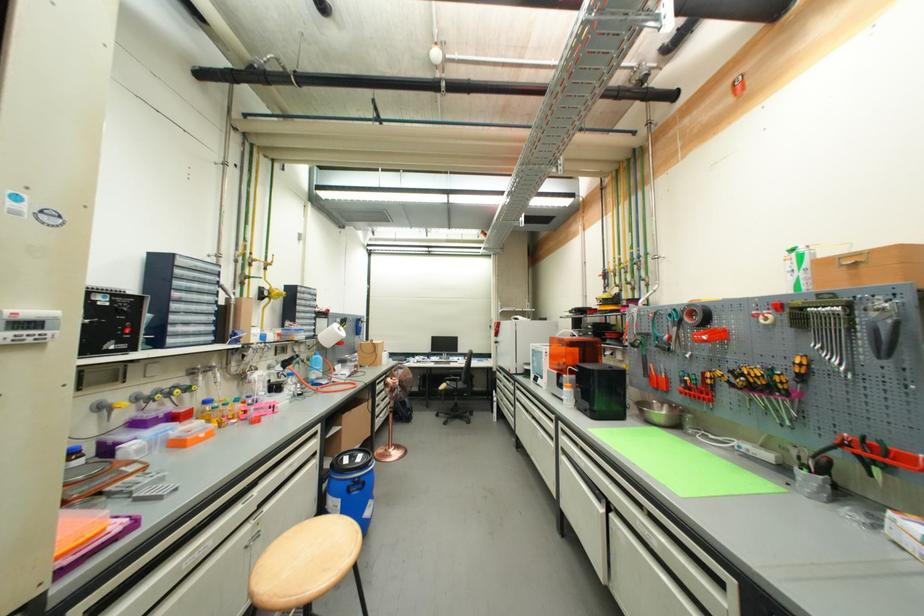
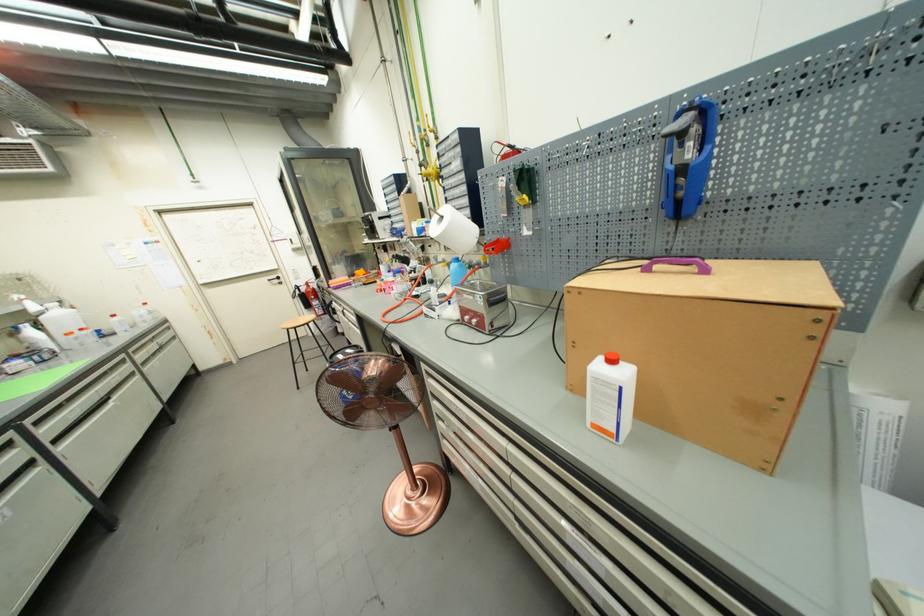
In the second image, find the point that corresponds to pixel 391 353 in the first image.

(617, 363)